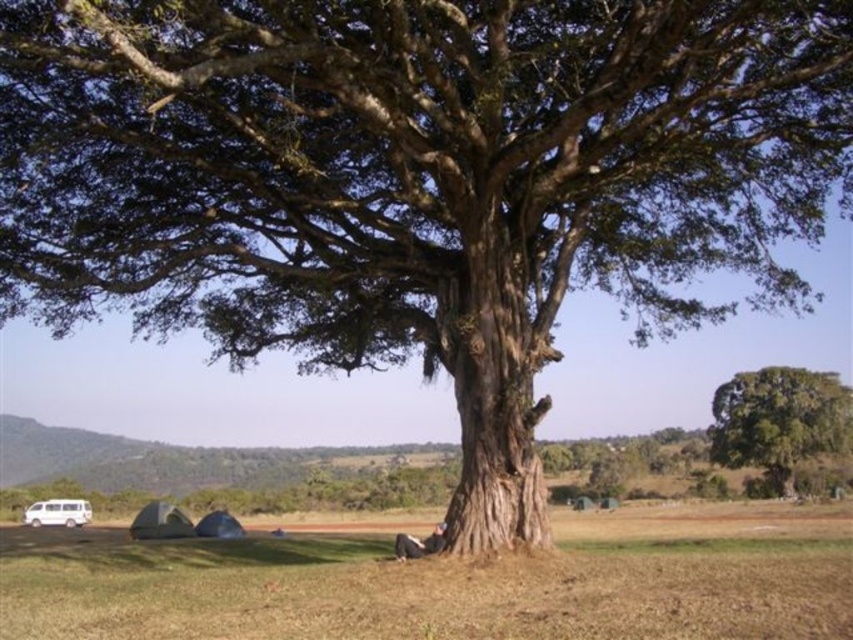
You are standing at the center of the image and want to walk towards the brown grass at lower center. Which direction should you move in?

The brown grass at lower center is located at point 0.906 on the x axis and 0.521 on the y axis. Since you are at the center, you should move towards the lower right direction to reach it.

You are planning to set up a tent in the area shown. Considering the green rough bark tree at upper right and the white matte van at lower left, which object takes up more space in the image?

The white matte van at lower left occupies more space in the image than the green rough bark tree at upper right, so the van takes up more space.